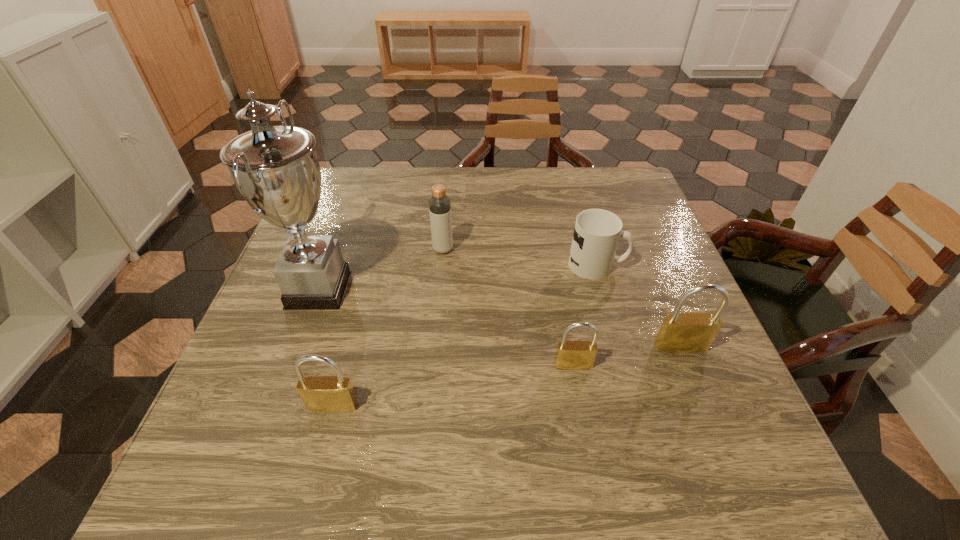
In the image, there is a desktop. Identify the location of vacant space at the right edge. The width and height of the screenshot is (960, 540). (702, 357).

This screenshot has height=540, width=960. I want to click on vacant space at the near left corner of the desktop, so click(x=223, y=401).

You are a GUI agent. You are given a task and a screenshot of the screen. Output one action in this format:
    pyautogui.click(x=<x>, y=<y>)
    Task: Click on the vacant point at the far right corner
    This screenshot has width=960, height=540.
    Given the screenshot: What is the action you would take?
    pyautogui.click(x=622, y=197)

Identify the location of vacant space in between the nearest object and the trophy cup. (325, 348).

I want to click on free spot between the third nearest object and the nearest padlock, so (507, 376).

Where is `free space between the mug and the fourth object from right to left`? This screenshot has width=960, height=540. free space between the mug and the fourth object from right to left is located at coordinates (520, 257).

The image size is (960, 540). Find the location of `free space between the nearest object and the rightmost padlock`. free space between the nearest object and the rightmost padlock is located at coordinates (507, 376).

This screenshot has height=540, width=960. What are the coordinates of `unoccupied position between the mug and the nearest object` in the screenshot? It's located at (465, 335).

Identify the location of free space between the bottle and the leftmost padlock. (x=388, y=328).

Where is `free point between the mug and the rightmost object`? This screenshot has width=960, height=540. free point between the mug and the rightmost object is located at coordinates (638, 306).